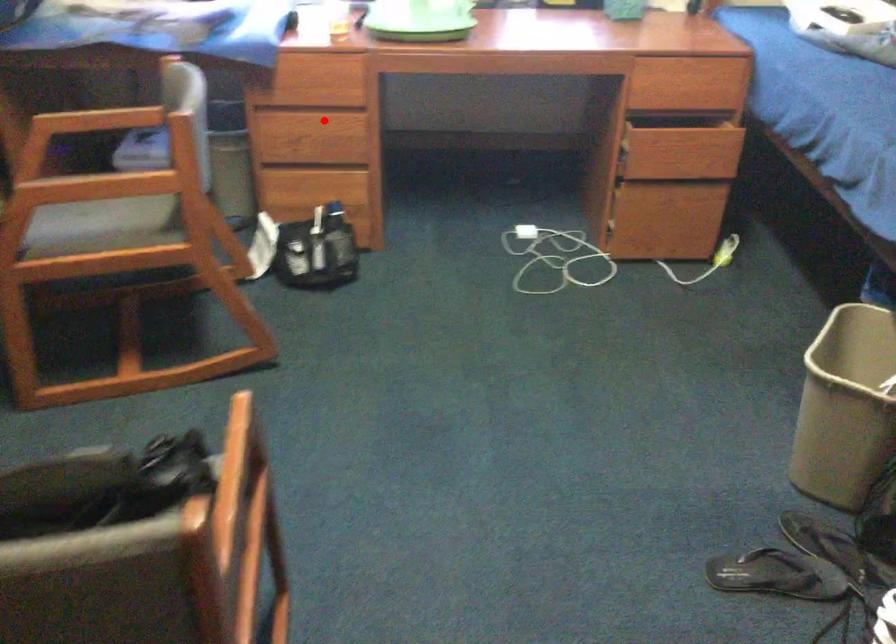
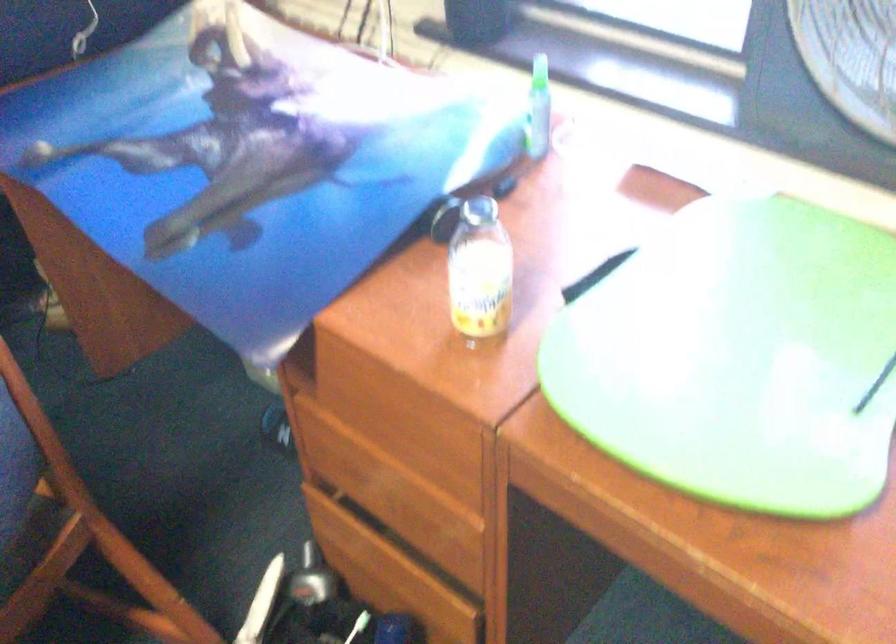
Question: A red point is marked in image1. In image2, is the corresponding 3D point closer to the camera or farther? Reply with the corresponding letter.

Choices:
 (A) The corresponding 3D point is closer.
 (B) The corresponding 3D point is farther.

Answer: (A)